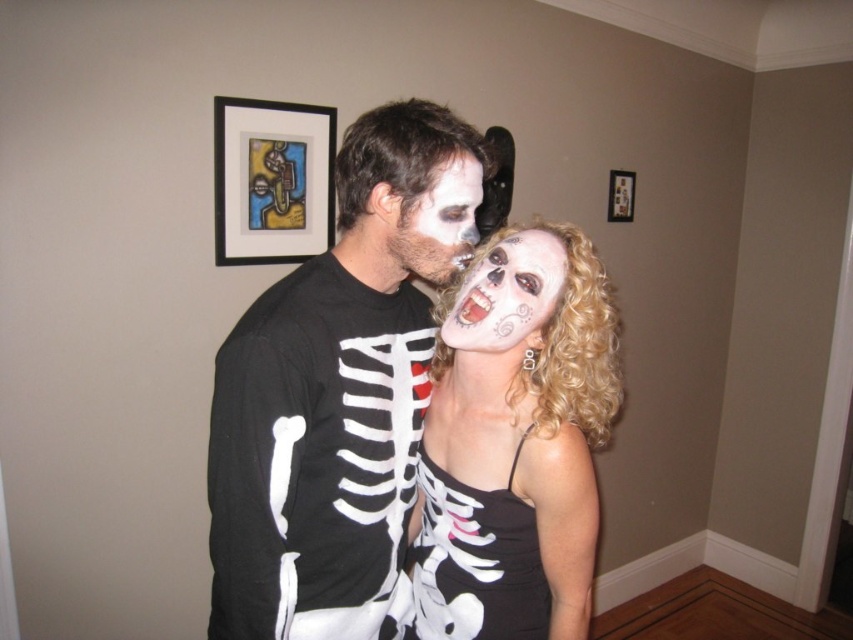
Question: Which of the following is the closest to the observer?

Choices:
 (A) (413, 579)
 (B) (619, 214)
 (C) (480, 170)
 (D) (601, 420)

Answer: (C)

Question: Can you confirm if white matte skeleton dress at center is wider than black satin dress at center?

Choices:
 (A) yes
 (B) no

Answer: (A)

Question: Which object is positioned closest to the white matte skull at center?

Choices:
 (A) white matte skeleton dress at center
 (B) wooden picture frame at upper center
 (C) black matte picture frame at upper center
 (D) black satin dress at center

Answer: (A)

Question: Which point is closer to the camera?

Choices:
 (A) (416, 209)
 (B) (252, 104)
 (C) (579, 387)
 (D) (627, 205)

Answer: (A)

Question: Can you confirm if matte black t-shirt with skeleton design at center is wider than black satin dress at center?

Choices:
 (A) no
 (B) yes

Answer: (B)

Question: Can you confirm if black satin dress at center is positioned below black matte picture frame at upper center?

Choices:
 (A) no
 (B) yes

Answer: (B)